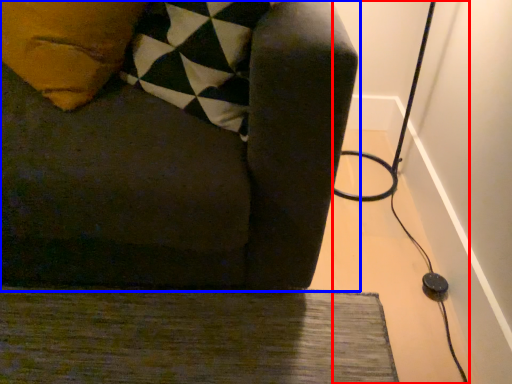
Question: Which object is closer to the camera taking this photo, cable (highlighted by a red box) or furniture (highlighted by a blue box)?

Choices:
 (A) cable
 (B) furniture

Answer: (B)